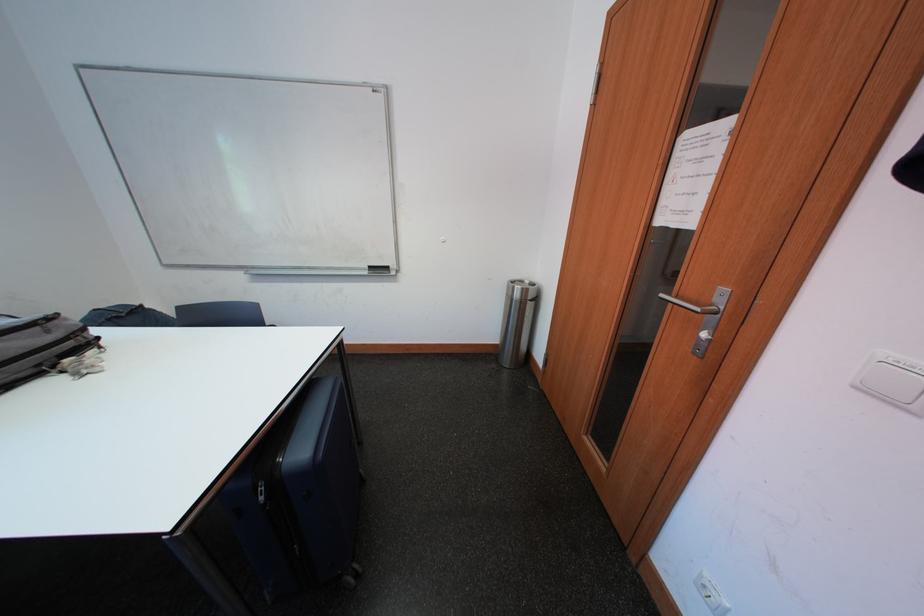
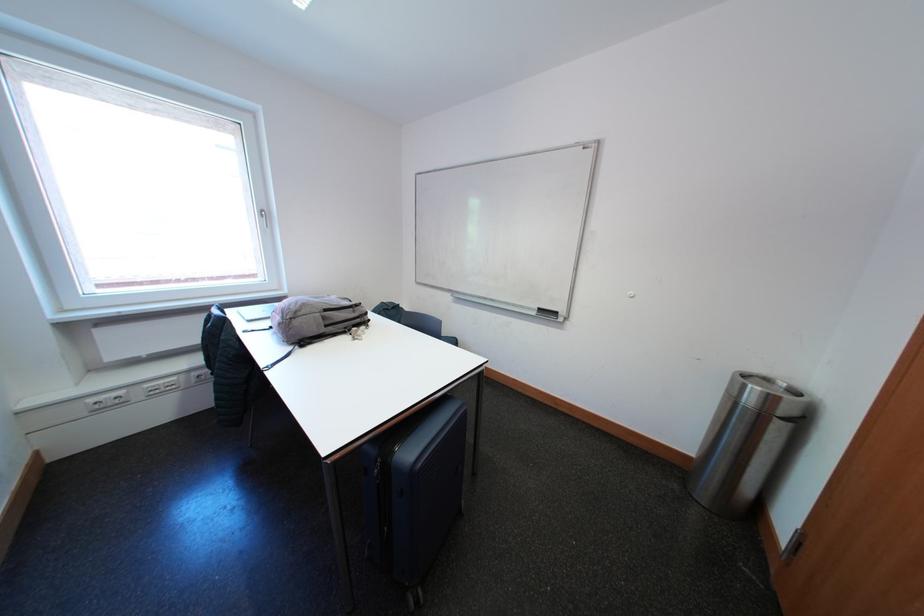
Question: Based on the continuous images, in which direction is the camera rotating? Reply with the corresponding letter.

Choices:
 (A) Left
 (B) Right
 (C) Up
 (D) Down

Answer: (A)